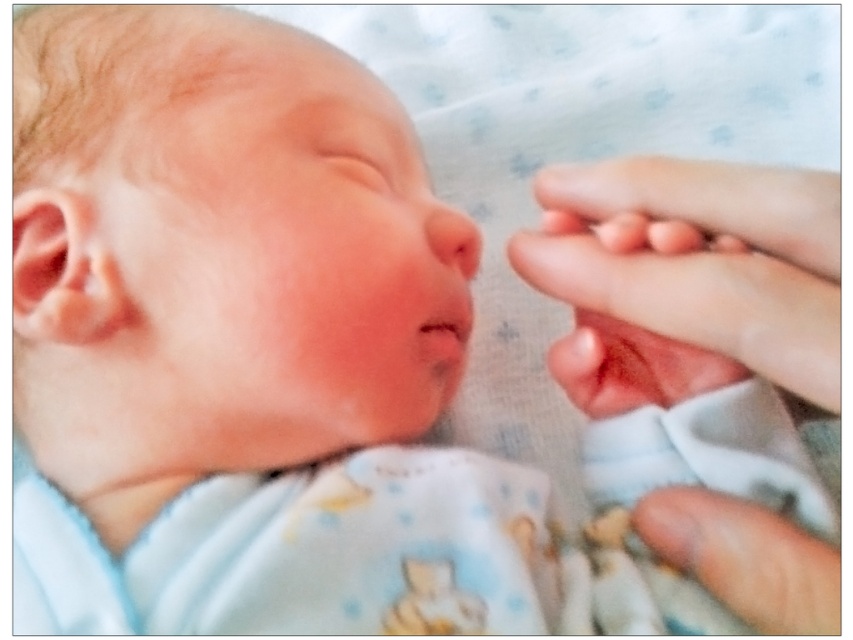
Looking at the newborn baby in the image, which object is taller between the smooth flesh nose at center and the pink smooth skin at center?

The smooth flesh nose at center is taller than the pink smooth skin at center.